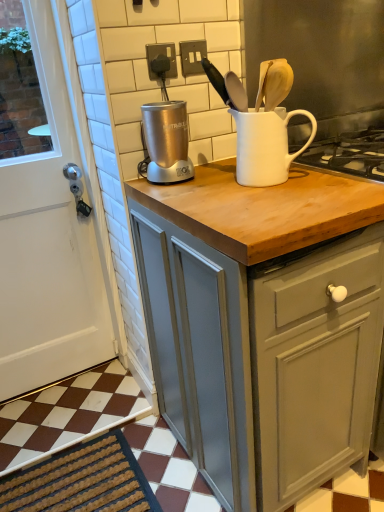
Question: In terms of size, does white matte door at left appear bigger or smaller than white ceramic jug at upper center?

Choices:
 (A) big
 (B) small

Answer: (A)

Question: Is point (59, 109) positioned closer to the camera than point (241, 155)?

Choices:
 (A) closer
 (B) farther

Answer: (B)

Question: Which object is positioned closest to the matte gray cabinet at center?

Choices:
 (A) satin silver blender at upper center
 (B) dark brown textured mat at lower left
 (C) white matte door at left
 (D) white ceramic jug at upper center

Answer: (D)

Question: Based on their relative distances, which object is farther from the matte gray cabinet at center?

Choices:
 (A) dark brown textured mat at lower left
 (B) satin silver blender at upper center
 (C) white ceramic jug at upper center
 (D) white matte door at left

Answer: (D)